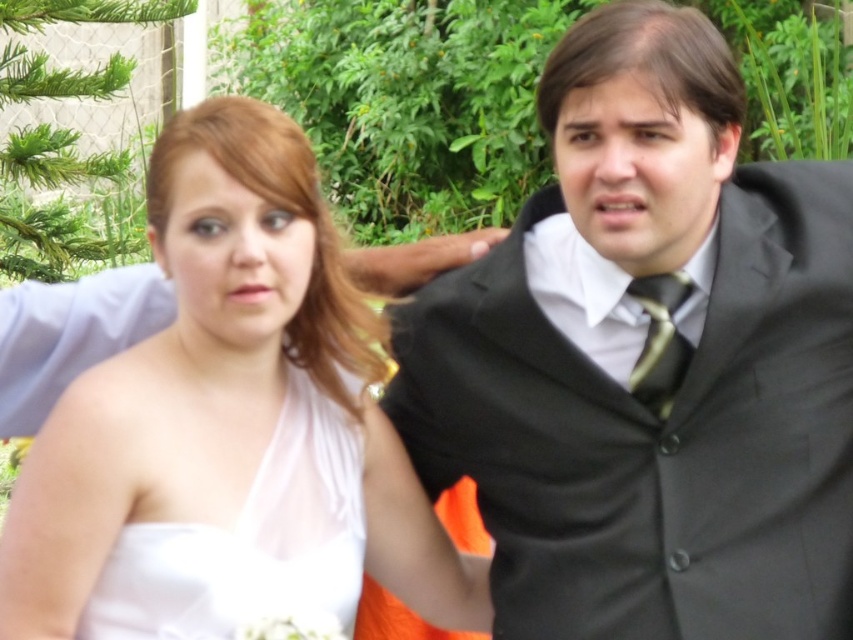
You are a photographer at a wedding and need to capture a photo of both the white satin dress at center and the white satin dress at left. Since both dresses are white, how can you ensure you can distinguish between them in the photo?

The white satin dress at center is positioned on the right side of white satin dress at left, so you can distinguish them by their relative positions in the photo.

You are a photographer at a wedding and need to capture a closeup of the white satin dress at center and the white satin dress at left. Since you can only focus on one dress at a time, which dress should you focus on to ensure the background remains in focus?

The white satin dress at left is further away from the camera than the white satin dress at center. To keep the background in focus, you should focus on the white satin dress at left.